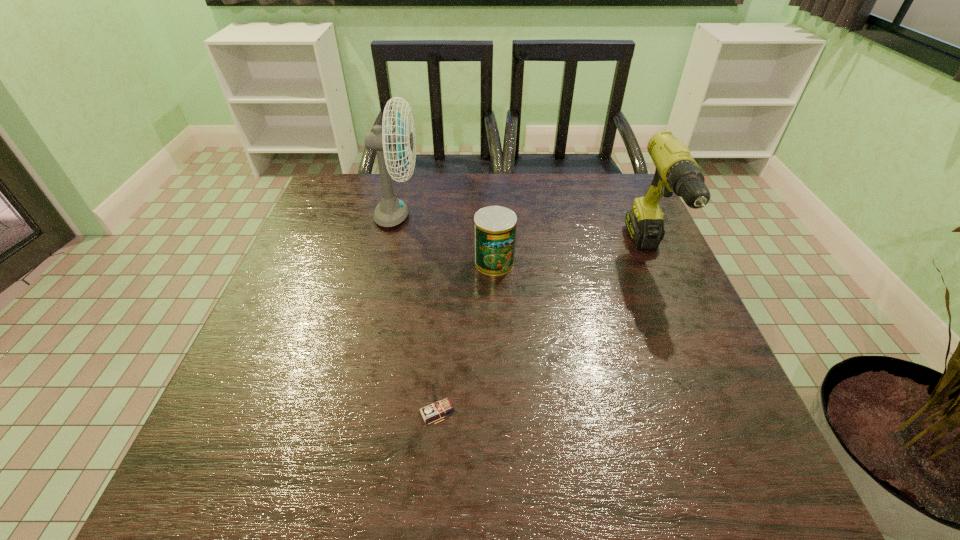
The image size is (960, 540). I want to click on vacant space located 0.310m on the back of the matchbox, so click(447, 282).

At what (x,y) coordinates should I click in order to perform the action: click on object that is at the far edge. Please return your answer as a coordinate pair (x, y). Looking at the image, I should click on [391, 211].

At what (x,y) coordinates should I click in order to perform the action: click on object at the right edge. Please return your answer as a coordinate pair (x, y). The image size is (960, 540). Looking at the image, I should click on (676, 171).

The width and height of the screenshot is (960, 540). In the image, there is a desktop. Identify the location of vacant space at the far edge. click(403, 195).

Locate an element on the screen. The image size is (960, 540). vacant point at the near edge is located at coordinates (639, 464).

Where is `vacant area at the left edge of the desktop`? This screenshot has height=540, width=960. vacant area at the left edge of the desktop is located at coordinates (300, 406).

The width and height of the screenshot is (960, 540). I want to click on free point at the right edge, so click(x=683, y=420).

Identify the location of vacant space at the far left corner of the desktop. (320, 208).

Identify the location of free space between the matchbox and the drill. (543, 334).

At what (x,y) coordinates should I click in order to perform the action: click on unoccupied area between the second object from right to left and the nearest object. Please return your answer as a coordinate pair (x, y). Looking at the image, I should click on (466, 337).